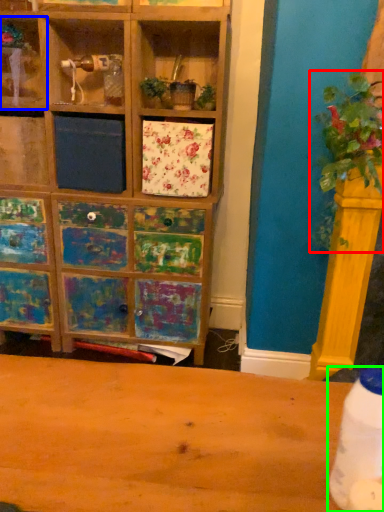
Question: Which object is positioned farthest from floral arrangement (highlighted by a red box)? Select from shelf (highlighted by a blue box) and bottle (highlighted by a green box).

Choices:
 (A) shelf
 (B) bottle

Answer: (A)